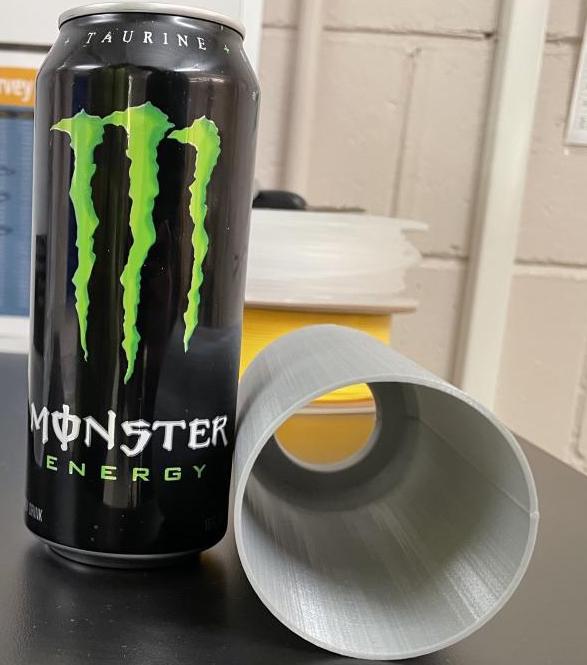
Find the location of a particular element. The width and height of the screenshot is (587, 665). white blue poster is located at coordinates (301, 261), (20, 146).